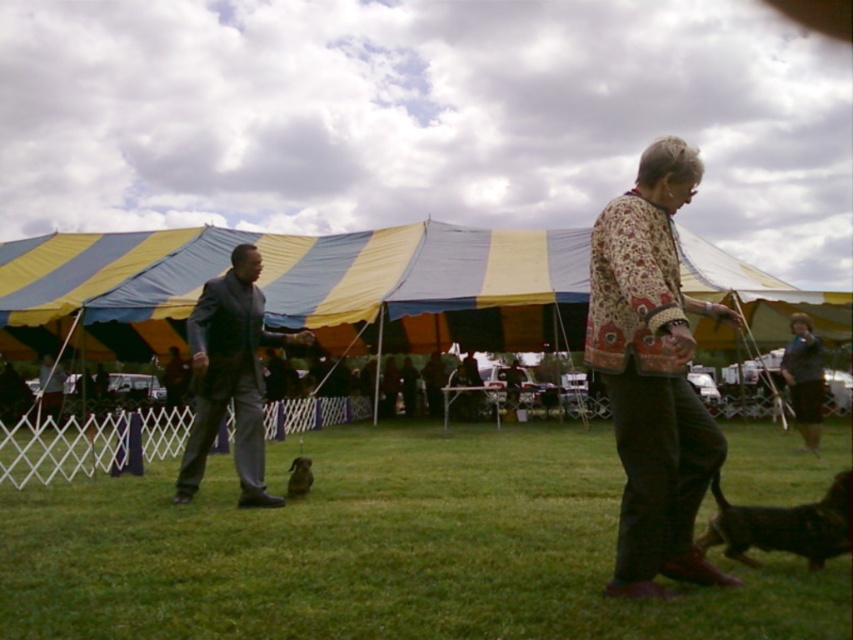
Question: Is floral-patterned fabric at center wider than brown fur dog at lower right?

Choices:
 (A) yes
 (B) no

Answer: (A)

Question: Which of the following is the closest to the observer?

Choices:
 (A) (664, 433)
 (B) (231, 296)
 (C) (251, 541)
 (D) (297, 460)

Answer: (A)

Question: Which of the following is the closest to the observer?

Choices:
 (A) green grass at center
 (B) floral-patterned fabric at center
 (C) brown furry dog at center
 (D) brown fur dog at lower right

Answer: (B)

Question: Is the position of dark gray suit at left more distant than that of brown fur dog at lower right?

Choices:
 (A) yes
 (B) no

Answer: (A)

Question: Which of the following is the closest to the observer?

Choices:
 (A) brown fur dog at lower right
 (B) dark gray suit at left
 (C) floral-patterned fabric at center
 (D) brown furry dog at center

Answer: (C)

Question: Does green grass at center have a smaller size compared to floral-patterned fabric at center?

Choices:
 (A) no
 (B) yes

Answer: (B)